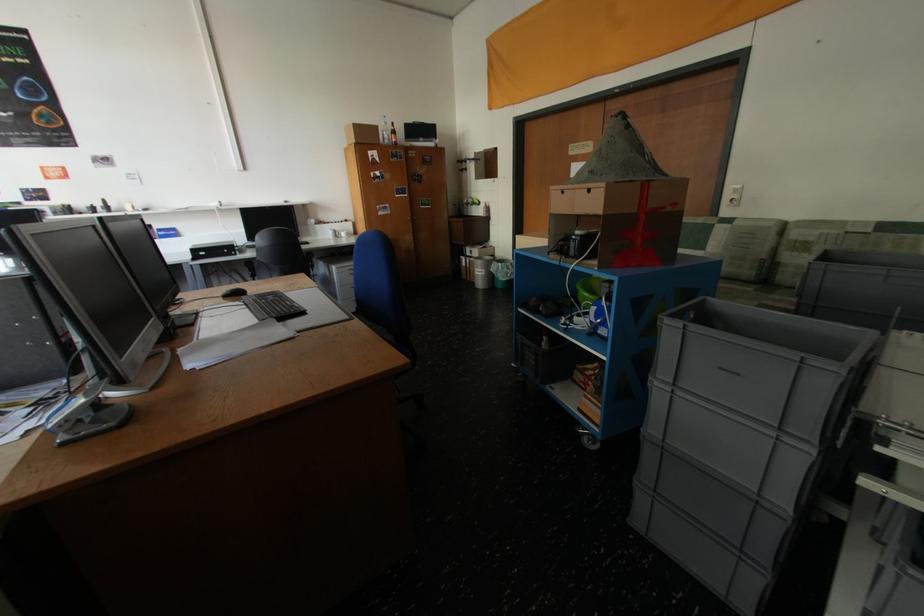
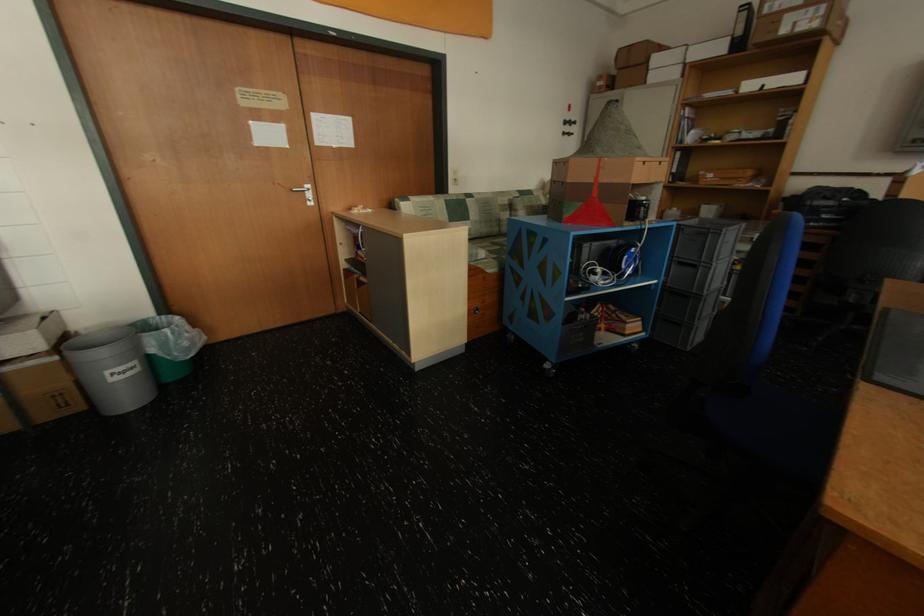
Where in the second image is the point corresponding to point (508, 265) from the first image?

(176, 331)